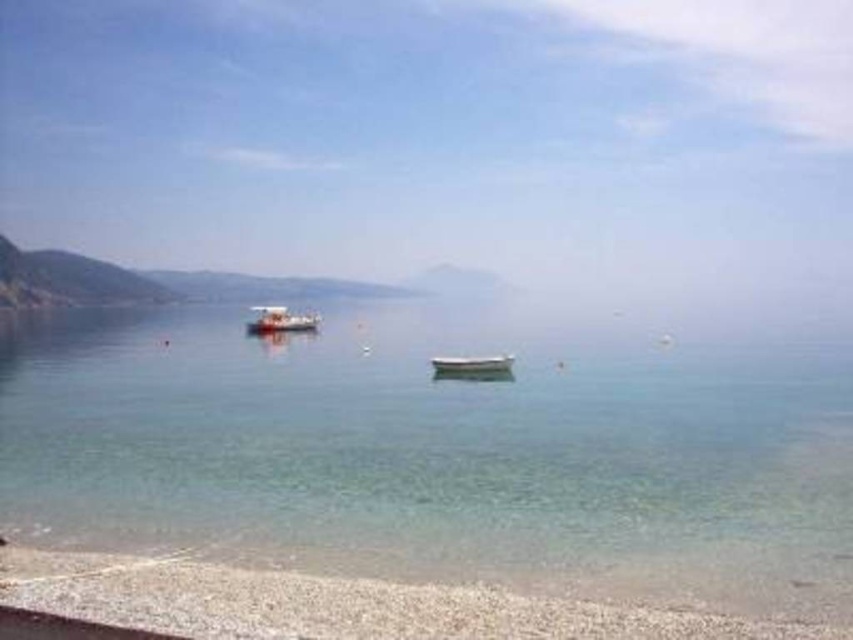
Which of these two, clear water at center or white gravel beach at lower left, stands shorter?

With less height is white gravel beach at lower left.

Is clear water at center above white gravel beach at lower left?

Indeed, clear water at center is positioned over white gravel beach at lower left.

Who is more distant from viewer, (97, 458) or (190, 595)?

The point (97, 458) is more distant.

The image size is (853, 640). Find the location of `clear water at center`. clear water at center is located at coordinates (422, 438).

Measure the distance between clear water at center and white glossy boat at center.

clear water at center and white glossy boat at center are 38.46 meters apart from each other.

Which is below, clear water at center or white glossy boat at center?

white glossy boat at center is lower down.

Based on the photo, who is more forward, [726,461] or [444,358]?

Point [726,461] is more forward.

What are the coordinates of `clear water at center` in the screenshot? It's located at (422, 438).

Which of these two, white gravel beach at lower left or white glossy boat at center, stands shorter?

white gravel beach at lower left is shorter.

Does white gravel beach at lower left have a greater height compared to white glossy boat at center?

No, white gravel beach at lower left is not taller than white glossy boat at center.

Which is behind, point (4, 557) or point (439, 362)?

Point (439, 362)

The image size is (853, 640). Identify the location of white gravel beach at lower left. (341, 604).